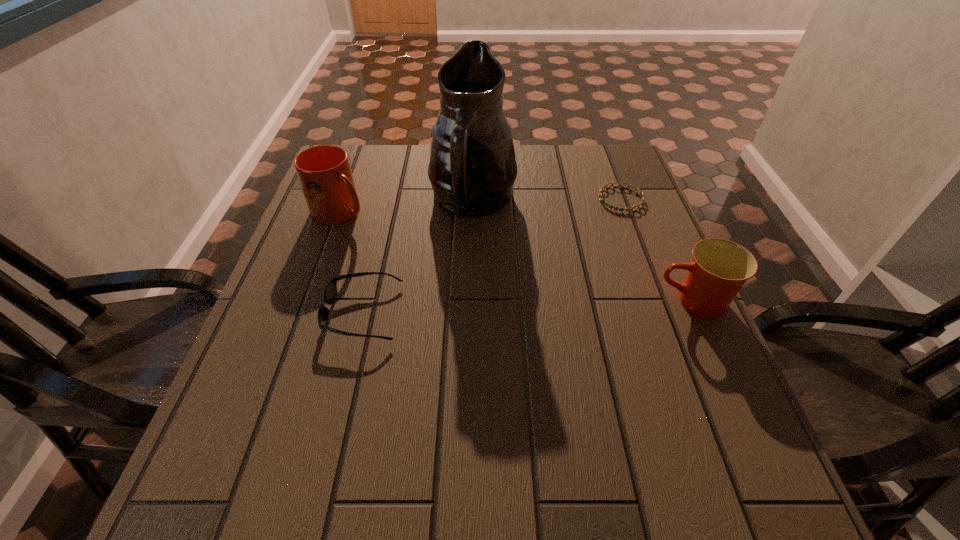
In order to click on free point between the cup and the fourth tallest object in this screenshot , I will do `click(527, 307)`.

The image size is (960, 540). Find the location of `empty space between the third tallest object and the mug`. empty space between the third tallest object and the mug is located at coordinates (516, 257).

At what (x,y) coordinates should I click in order to perform the action: click on unoccupied position between the pitcher and the fourth tallest object. Please return your answer as a coordinate pair (x, y). Looking at the image, I should click on (418, 257).

The width and height of the screenshot is (960, 540). I want to click on free spot between the third tallest object and the pitcher, so 583,252.

The height and width of the screenshot is (540, 960). Identify the location of free space between the pitcher and the third shortest object. (583, 252).

Where is `vacant area that lies between the bracelet and the sunglasses`? Image resolution: width=960 pixels, height=540 pixels. vacant area that lies between the bracelet and the sunglasses is located at coordinates (492, 256).

I want to click on free spot between the cup and the second tallest object, so click(x=516, y=257).

The width and height of the screenshot is (960, 540). Find the location of `vacant area that lies between the sunglasses and the cup`. vacant area that lies between the sunglasses and the cup is located at coordinates (527, 307).

Where is `free area in between the third tallest object and the tallest object`? The height and width of the screenshot is (540, 960). free area in between the third tallest object and the tallest object is located at coordinates (583, 252).

Where is `the closest object to the third object from right to left`? the closest object to the third object from right to left is located at coordinates (324, 172).